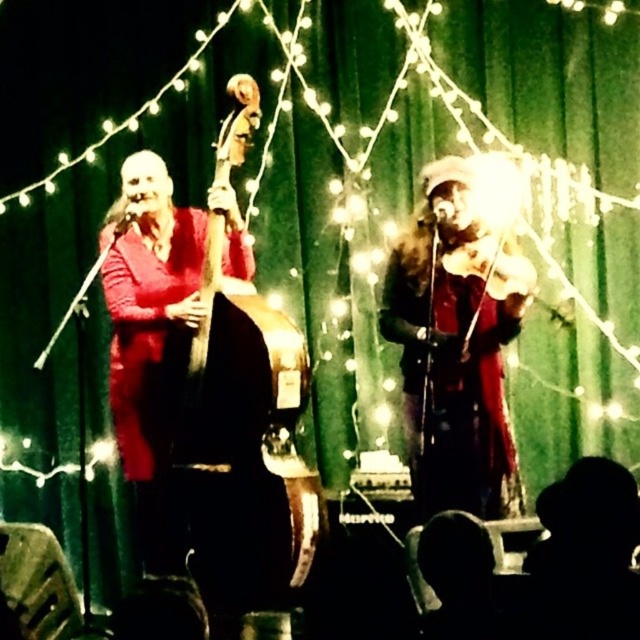
You are a stagehand preparing to move the wooden polished cello at left and the shiny red coat at center to the storage room. Which object requires a smaller storage space?

The wooden polished cello at left requires a smaller storage space since it has a smaller size compared to the shiny red coat at center.

You are a stagehand setting up a new microphone stand. You need to place it between the wooden polished cello at left and the shiny red coat at center so that it doesn

The wooden polished cello at left is taller than the shiny red coat at center. Therefore, the microphone stand should be placed closer to the shiny red coat at center to ensure it doesn